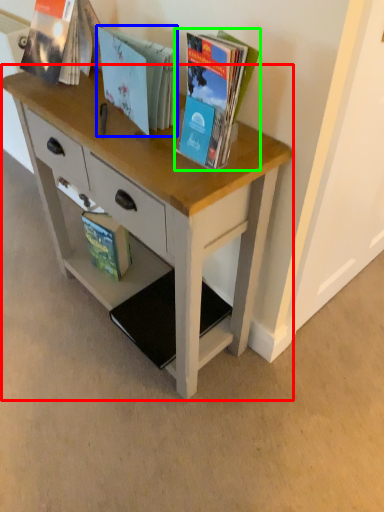
Question: Considering the real-world distances, which object is farthest from desk (highlighted by a red box)? book (highlighted by a blue box) or book (highlighted by a green box)?

Choices:
 (A) book
 (B) book

Answer: (B)